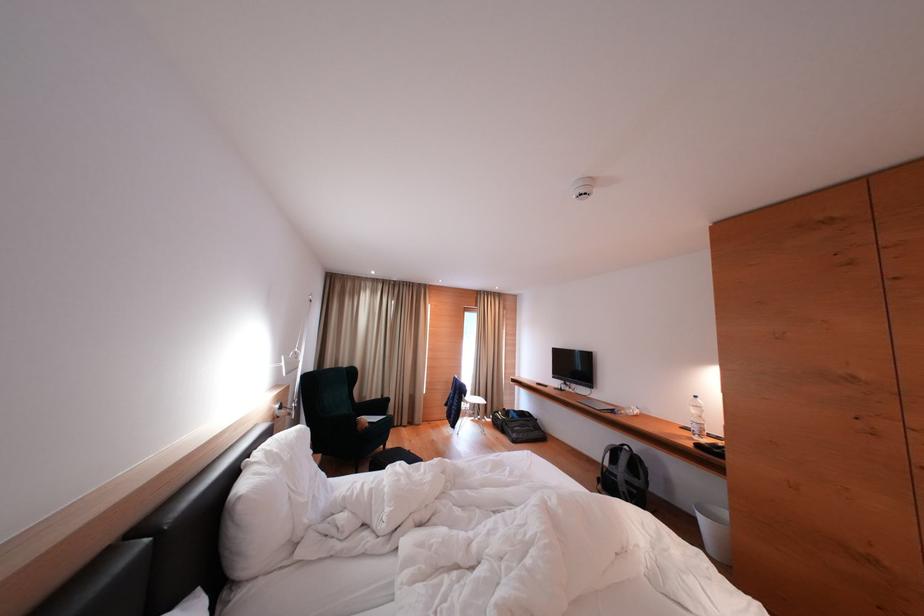
Find the location of a particular element. This screenshot has height=616, width=924. chair sitting surface is located at coordinates (371, 419).